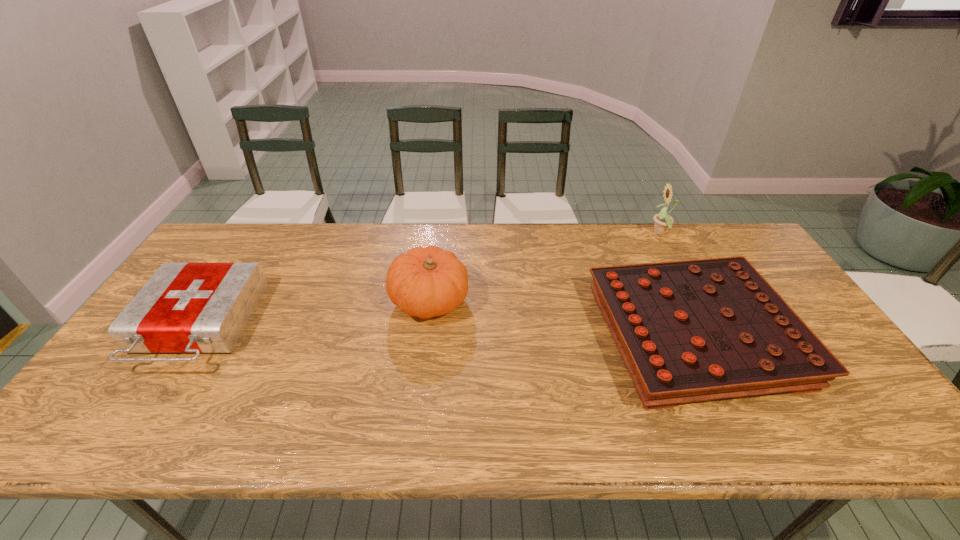
Where is `vacant area situated on the front side of the first-aid kit`? The height and width of the screenshot is (540, 960). vacant area situated on the front side of the first-aid kit is located at coordinates [121, 444].

Where is `vacant area situated on the left of the gameboard`? vacant area situated on the left of the gameboard is located at coordinates (451, 336).

The height and width of the screenshot is (540, 960). Identify the location of object positioned at the far edge. [x=663, y=221].

At what (x,y) coordinates should I click in order to perform the action: click on object located in the near edge section of the desktop. Please return your answer as a coordinate pair (x, y). Looking at the image, I should click on (695, 330).

The image size is (960, 540). Identify the location of object present at the left edge. (197, 308).

Where is `object at the right edge`? This screenshot has height=540, width=960. object at the right edge is located at coordinates (695, 330).

Where is `object that is at the near right corner`? The image size is (960, 540). object that is at the near right corner is located at coordinates (695, 330).

Locate an element on the screen. vacant space at the far edge of the desktop is located at coordinates (275, 266).

The height and width of the screenshot is (540, 960). In the image, there is a desktop. In order to click on free space at the near edge in this screenshot , I will do `click(606, 422)`.

In the image, there is a desktop. What are the coordinates of `vacant space at the right edge` in the screenshot? It's located at (760, 267).